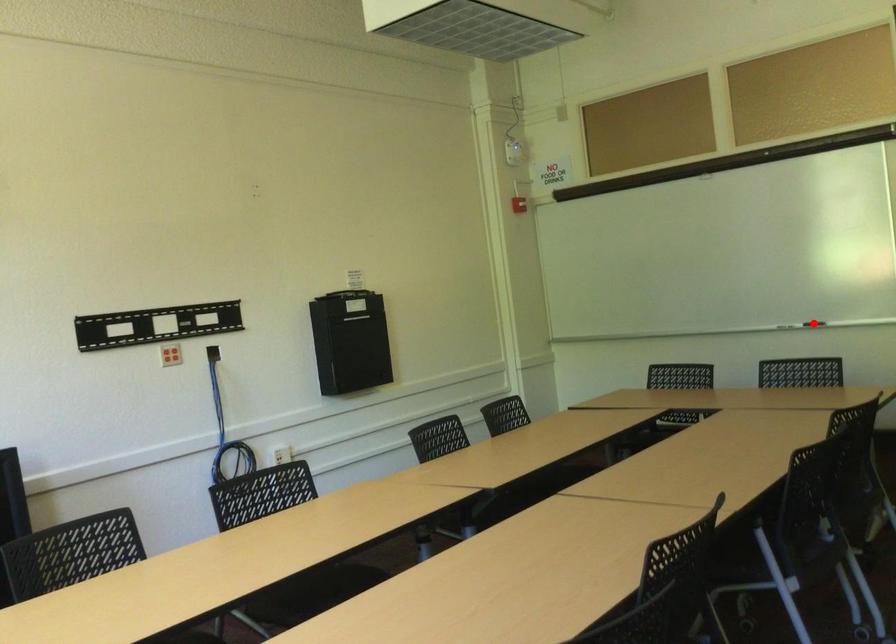
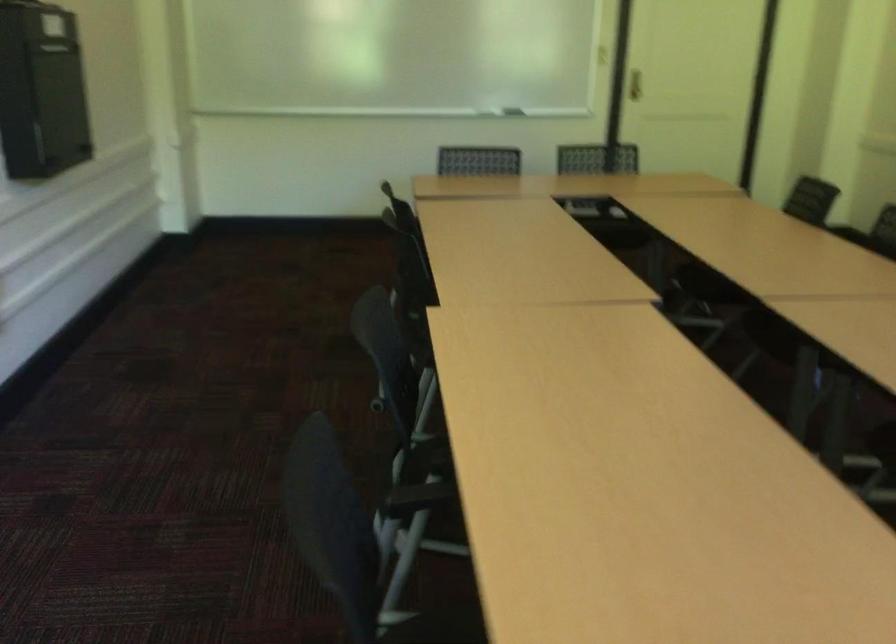
Question: I am providing you with two images of the same scene from different viewpoints. A red point is marked on the first image. Is the red point's position out of view in image 2?

Choices:
 (A) Yes
 (B) No

Answer: (A)